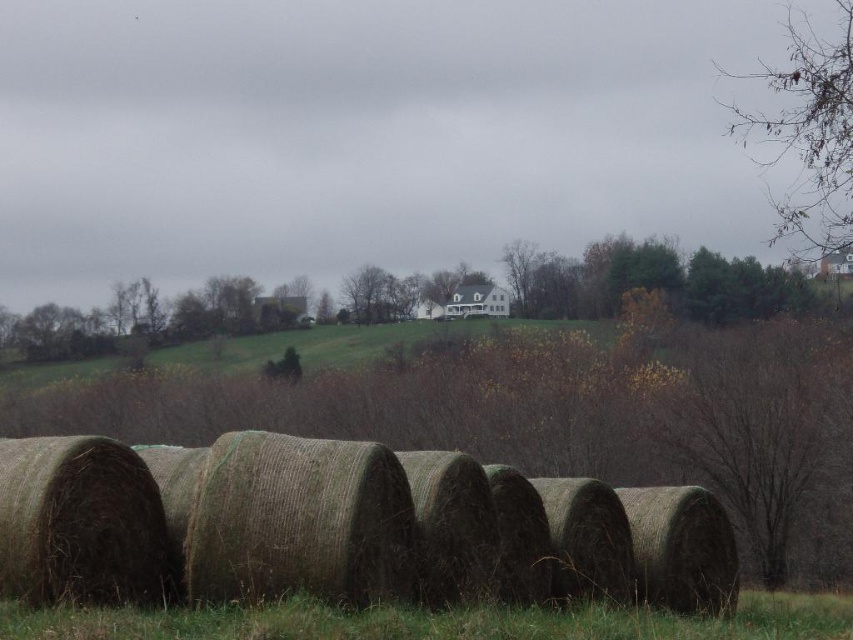
I want to click on green straw bales at center, so click(x=341, y=525).

Between green straw bales at center and green grass at lower center, which one has less height?

With less height is green grass at lower center.

This screenshot has height=640, width=853. I want to click on green straw bales at center, so click(x=341, y=525).

Identify the location of green straw bales at center. This screenshot has width=853, height=640. (341, 525).